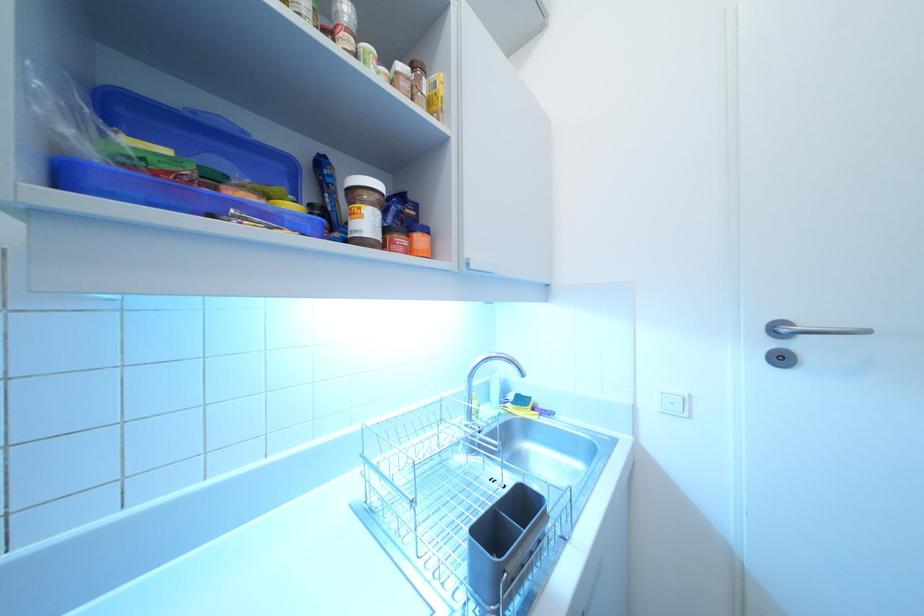
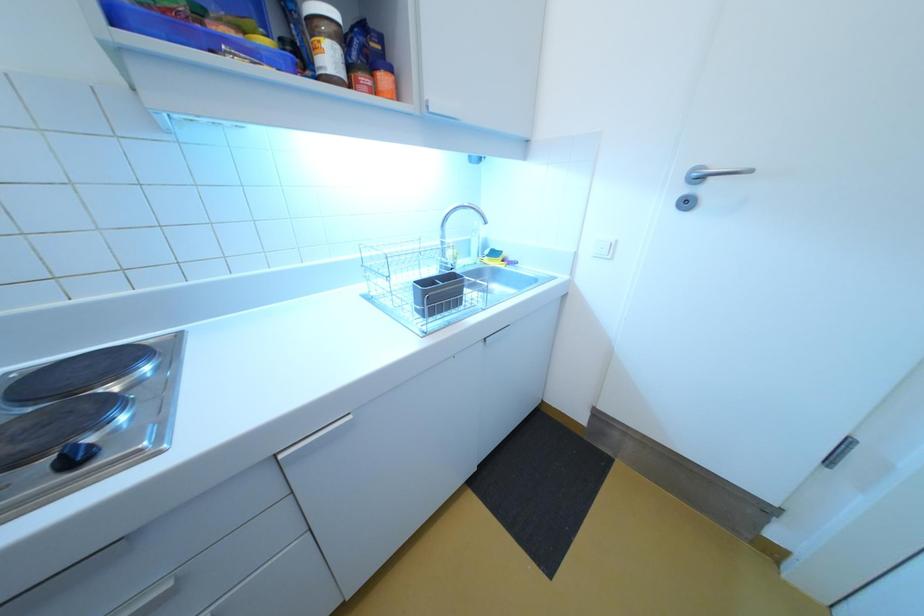
Question: The first image is from the beginning of the video and the second image is from the end. How did the camera likely rotate when shooting the video?

Choices:
 (A) Left
 (B) Right
 (C) Up
 (D) Down

Answer: (D)